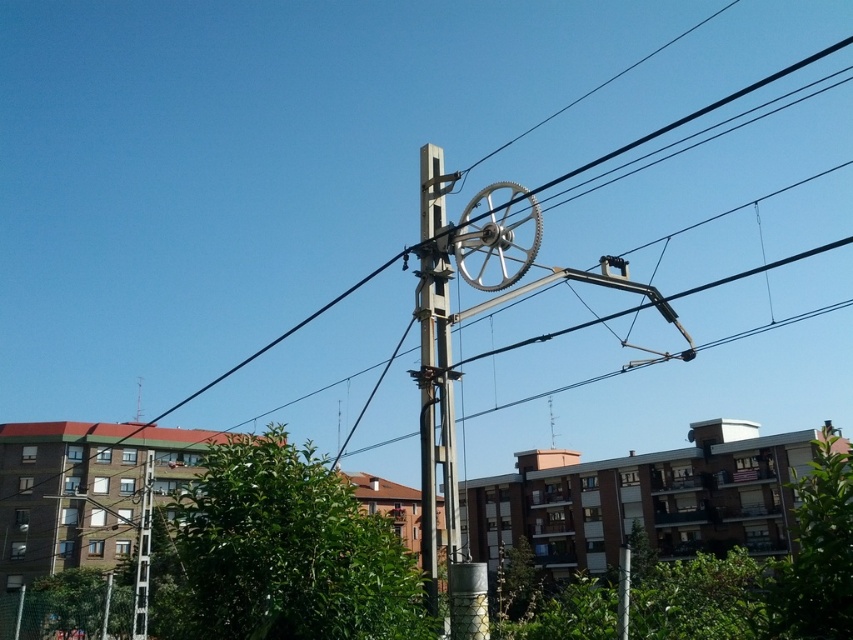
Question: Does metallic gray telegraph pole at center have a smaller size compared to white plastic telegraph pole at left?

Choices:
 (A) no
 (B) yes

Answer: (A)

Question: Can you confirm if metallic gray telegraph pole at center is wider than white plastic telegraph pole at left?

Choices:
 (A) no
 (B) yes

Answer: (A)

Question: Which point is closer to the camera?

Choices:
 (A) (143, 550)
 (B) (436, 240)

Answer: (B)

Question: Which point appears farthest from the camera in this image?

Choices:
 (A) (434, 593)
 (B) (149, 490)

Answer: (B)

Question: Does metallic gray telegraph pole at center appear under white plastic telegraph pole at left?

Choices:
 (A) no
 (B) yes

Answer: (A)